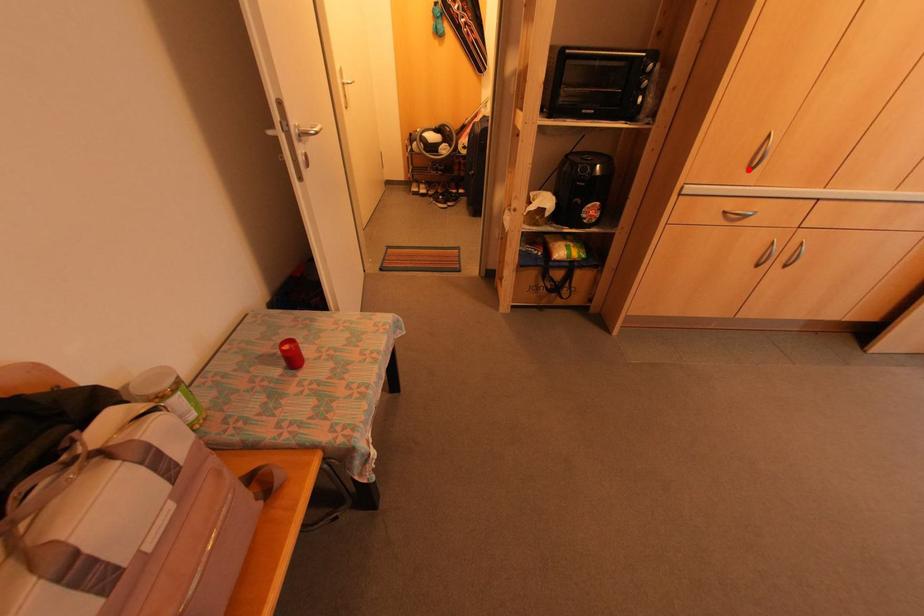
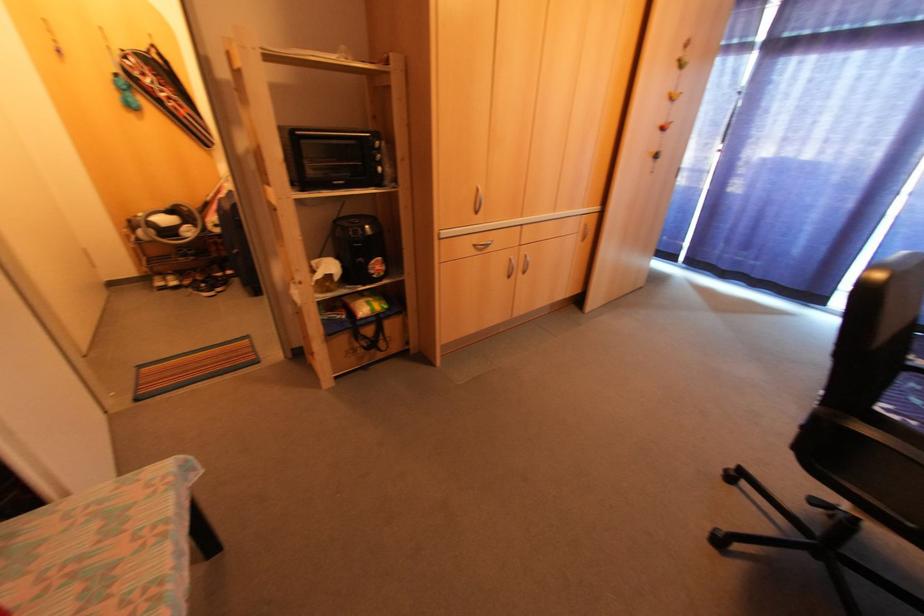
Find the pixel in the second image that matches the highlighted location in the first image.

(476, 213)